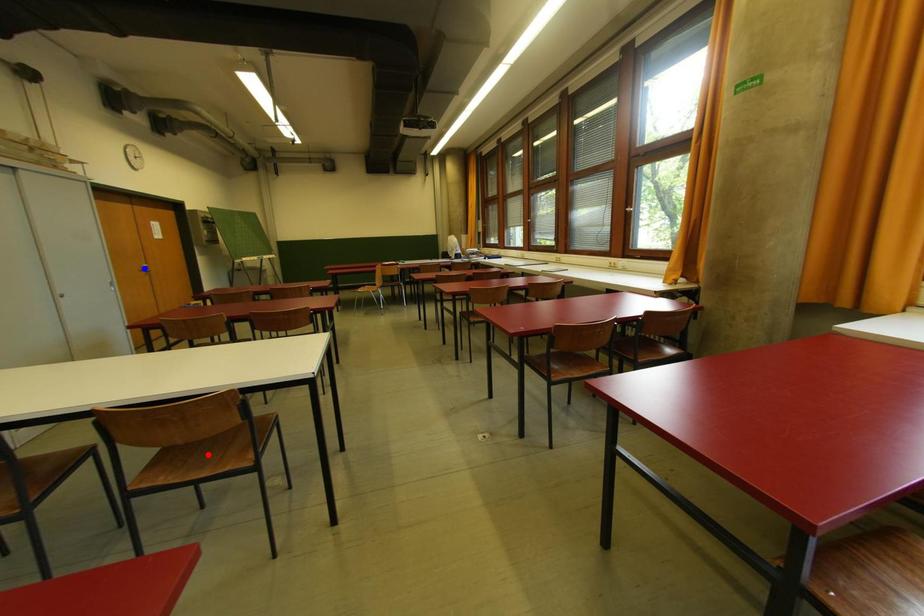
Question: Which of the two points in the image is closer to the camera?

Choices:
 (A) Blue point is closer.
 (B) Red point is closer.

Answer: (B)